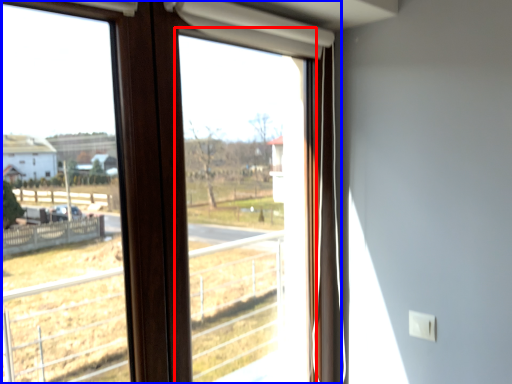
Question: Which point is further to the camera, window screen (highlighted by a red box) or window (highlighted by a blue box)?

Choices:
 (A) window screen
 (B) window

Answer: (A)